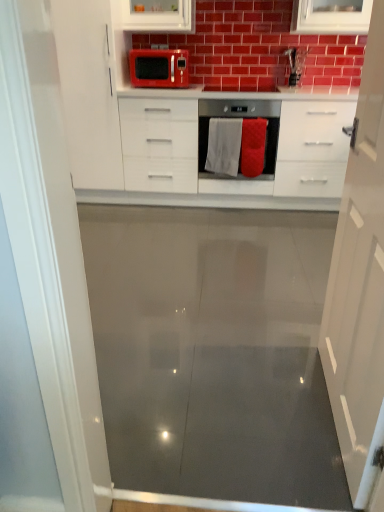
Question: Can you confirm if red fabric towel at center, which ranks as the first material in right-to-left order, is taller than white fabric towel at center, the second material when ordered from right to left?

Choices:
 (A) no
 (B) yes

Answer: (B)

Question: Can you see red fabric towel at center, which ranks as the first material in right-to-left order, touching white fabric towel at center, the second material when ordered from right to left?

Choices:
 (A) no
 (B) yes

Answer: (A)

Question: Can you confirm if red fabric towel at center, which ranks as the first material in right-to-left order, is bigger than white fabric towel at center, the second material when ordered from right to left?

Choices:
 (A) no
 (B) yes

Answer: (A)

Question: From a real-world perspective, is red fabric towel at center, which ranks as the first material in right-to-left order, positioned under white fabric towel at center, which is the 1th material from left to right, based on gravity?

Choices:
 (A) yes
 (B) no

Answer: (A)

Question: Is red fabric towel at center, marked as the 2th material in a left-to-right arrangement, not close to white fabric towel at center, which is the 1th material from left to right?

Choices:
 (A) no
 (B) yes

Answer: (A)

Question: Is white fabric towel at center, the second material when ordered from right to left, wider or thinner than red fabric towel at center, marked as the 2th material in a left-to-right arrangement?

Choices:
 (A) wide
 (B) thin

Answer: (B)

Question: Considering the positions of point (231, 123) and point (249, 153), is point (231, 123) closer or farther from the camera than point (249, 153)?

Choices:
 (A) farther
 (B) closer

Answer: (B)

Question: From the image's perspective, is white fabric towel at center, the second material when ordered from right to left, positioned above or below red fabric towel at center, which ranks as the first material in right-to-left order?

Choices:
 (A) above
 (B) below

Answer: (A)

Question: From a real-world perspective, relative to red fabric towel at center, marked as the 2th material in a left-to-right arrangement, is white fabric towel at center, the second material when ordered from right to left, vertically above or below?

Choices:
 (A) above
 (B) below

Answer: (A)

Question: From a real-world perspective, relative to white glossy cabinet at center, is satin silver oven at center vertically above or below?

Choices:
 (A) above
 (B) below

Answer: (A)

Question: Considering their positions, is satin silver oven at center located in front of or behind white glossy cabinet at center?

Choices:
 (A) front
 (B) behind

Answer: (B)

Question: Choose the correct answer: Is satin silver oven at center inside white glossy cabinet at center or outside it?

Choices:
 (A) inside
 (B) outside

Answer: (A)

Question: Looking at the image, does satin silver oven at center seem bigger or smaller compared to white glossy cabinet at center?

Choices:
 (A) small
 (B) big

Answer: (A)

Question: In terms of width, does matte red microwave at upper center look wider or thinner when compared to white glossy cabinet at left, the 2th cabinetry viewed from the right?

Choices:
 (A) thin
 (B) wide

Answer: (A)

Question: From the image's perspective, is matte red microwave at upper center located above or below white glossy cabinet at left, the 2th cabinetry viewed from the right?

Choices:
 (A) below
 (B) above

Answer: (B)